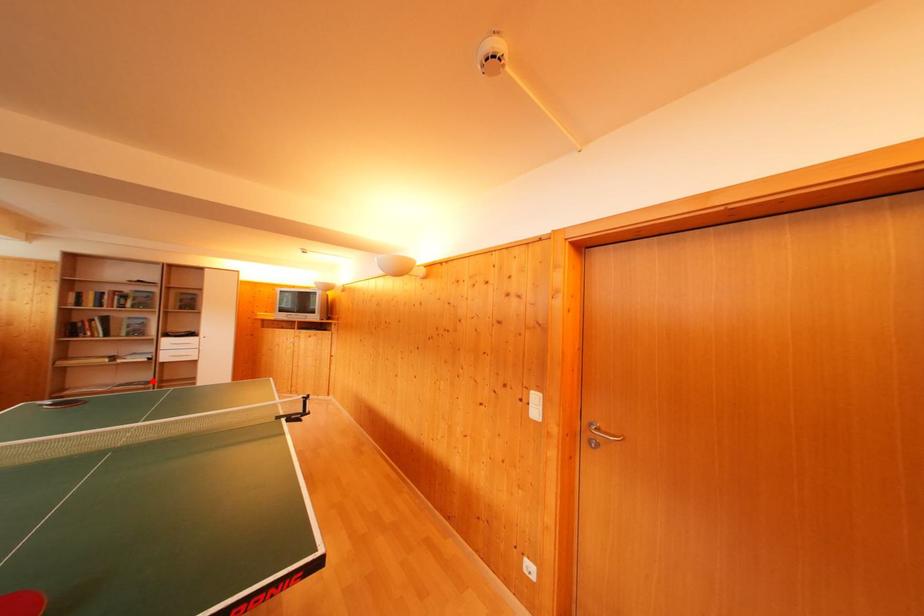
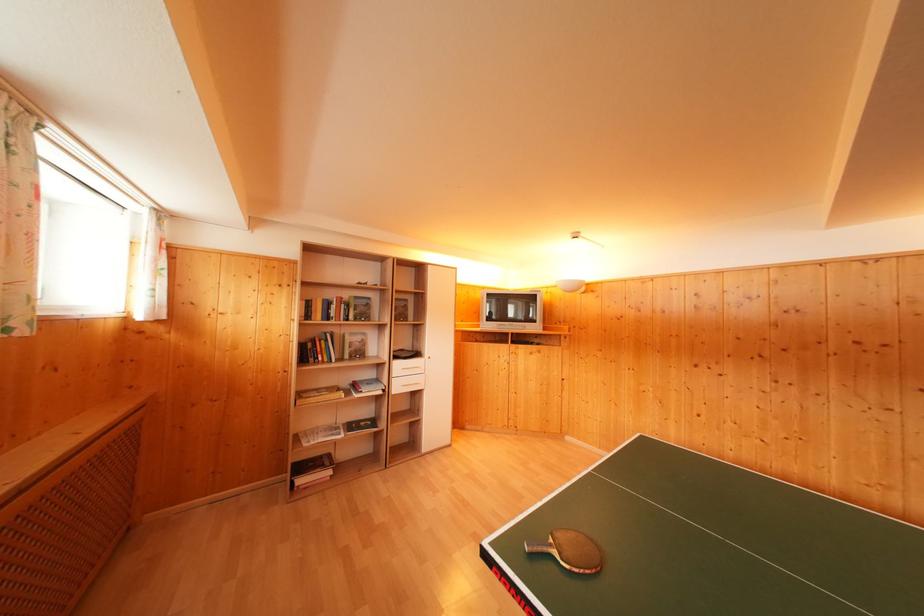
Question: I am providing you with two images of the same scene from different viewpoints. A red point is shown in image1. For the corresponding object point in image2, is it positioned nearer or farther from the camera?

Choices:
 (A) Nearer
 (B) Farther

Answer: (B)